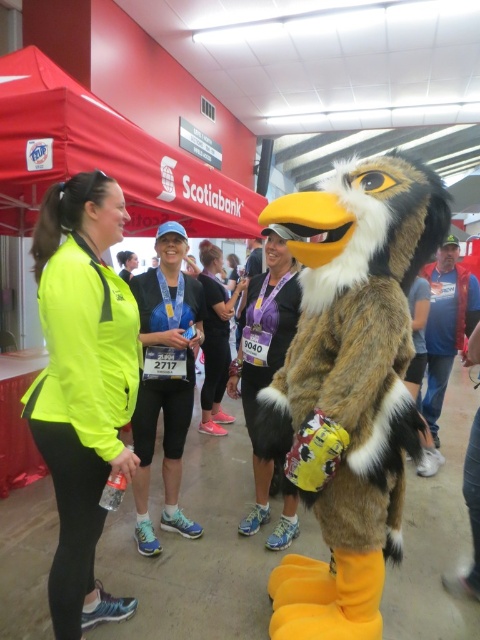
Between point (126, 460) and point (207, 241), which one is positioned in front?

Point (126, 460)

Measure the distance between point (97, 438) and camera.

1.55 meters

The height and width of the screenshot is (640, 480). What are the coordinates of `neon yellow jacket at left` in the screenshot? It's located at (83, 385).

Identify the location of neon yellow jacket at left. point(83,385).

Is neon yellow jacket at left thinner than neon yellow jacket at center?

Incorrect, neon yellow jacket at left's width is not less than neon yellow jacket at center's.

Find the location of `neon yellow jacket at left`. neon yellow jacket at left is located at coordinates [x=83, y=385].

Where is `neon yellow jacket at left`? Image resolution: width=480 pixels, height=640 pixels. neon yellow jacket at left is located at coordinates (83, 385).

At what (x,y) coordinates should I click in order to perform the action: click on white fur jacket at center. Please return your answer as a coordinate pair (x, y). Looking at the image, I should click on (264, 352).

Is white fur jacket at center shorter than black fabric leggings at center?

Correct, white fur jacket at center is not as tall as black fabric leggings at center.

Between point (280, 310) and point (203, 410), which one is positioned behind?

Positioned behind is point (203, 410).

You are a GUI agent. You are given a task and a screenshot of the screen. Output one action in this format:
    pyautogui.click(x=<x>, y=<y>)
    Task: Click on the white fur jacket at center
    Image resolution: width=480 pixels, height=640 pixels.
    Given the screenshot: What is the action you would take?
    pyautogui.click(x=264, y=352)